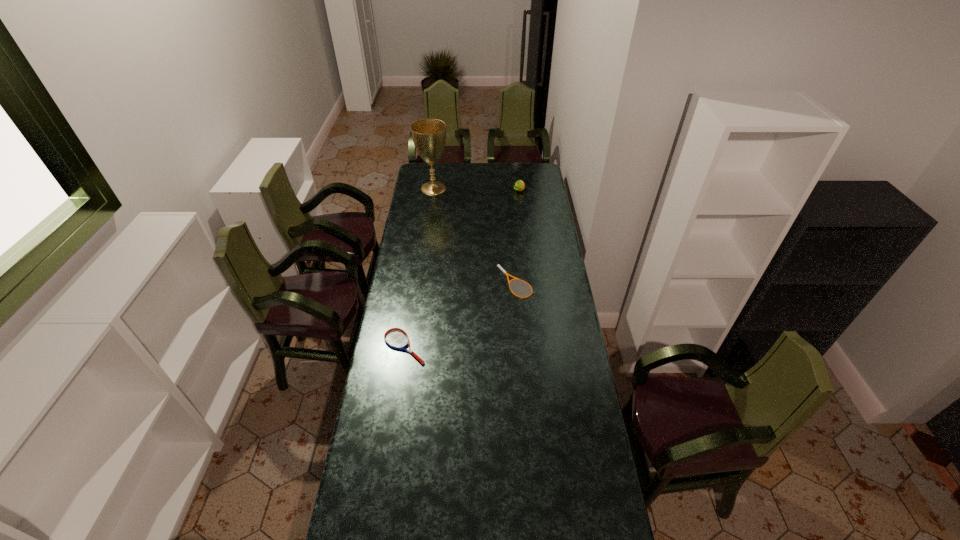
The height and width of the screenshot is (540, 960). Identify the location of object situated at the far edge. (429, 135).

The width and height of the screenshot is (960, 540). I want to click on trophy cup that is at the left edge, so click(429, 135).

This screenshot has height=540, width=960. I want to click on tennis racket that is at the left edge, so click(x=396, y=338).

Identify the location of lemon present at the right edge. The width and height of the screenshot is (960, 540). (519, 185).

Where is `tennis racket positioned at the right edge`? tennis racket positioned at the right edge is located at coordinates (498, 265).

Locate an element on the screen. The width and height of the screenshot is (960, 540). object at the far left corner is located at coordinates (429, 135).

Find the location of a particular element. The image size is (960, 540). free location at the left edge is located at coordinates (433, 230).

The height and width of the screenshot is (540, 960). In the image, there is a desktop. Find the location of `vacant space at the right edge`. vacant space at the right edge is located at coordinates (577, 380).

In the image, there is a desktop. Where is `free space at the far right corner`? The image size is (960, 540). free space at the far right corner is located at coordinates (520, 164).

Identify the location of empty location between the tallest object and the right tennis racket. The width and height of the screenshot is (960, 540). (474, 235).